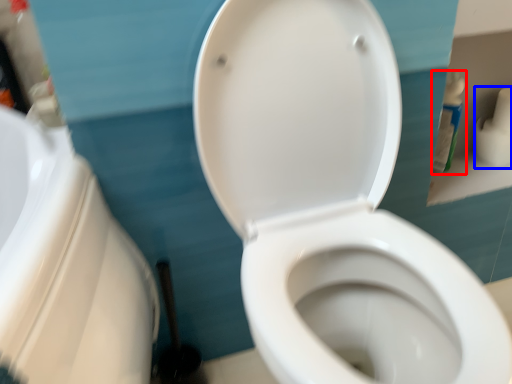
Question: Which object is closer to the camera taking this photo, cleaning product (highlighted by a red box) or toilet paper (highlighted by a blue box)?

Choices:
 (A) cleaning product
 (B) toilet paper

Answer: (A)